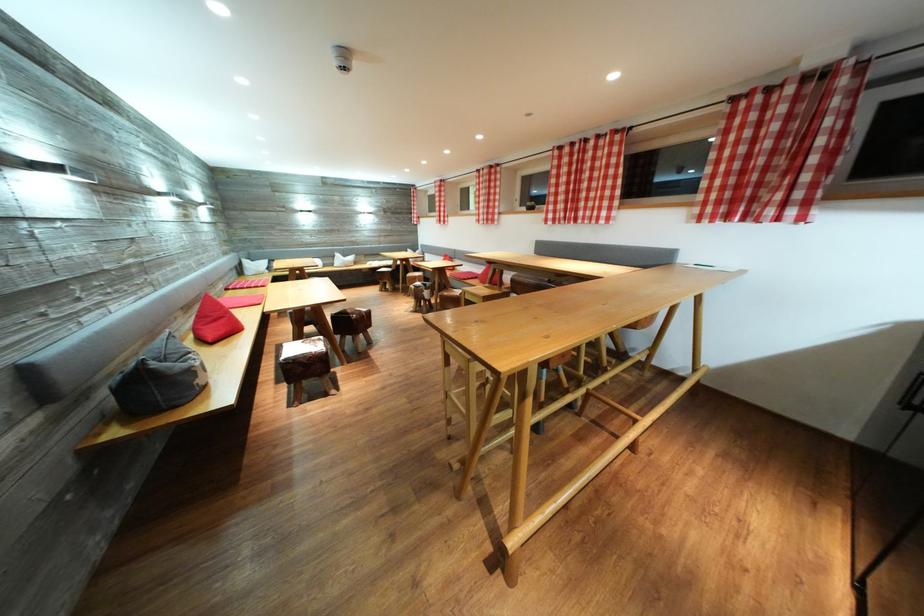
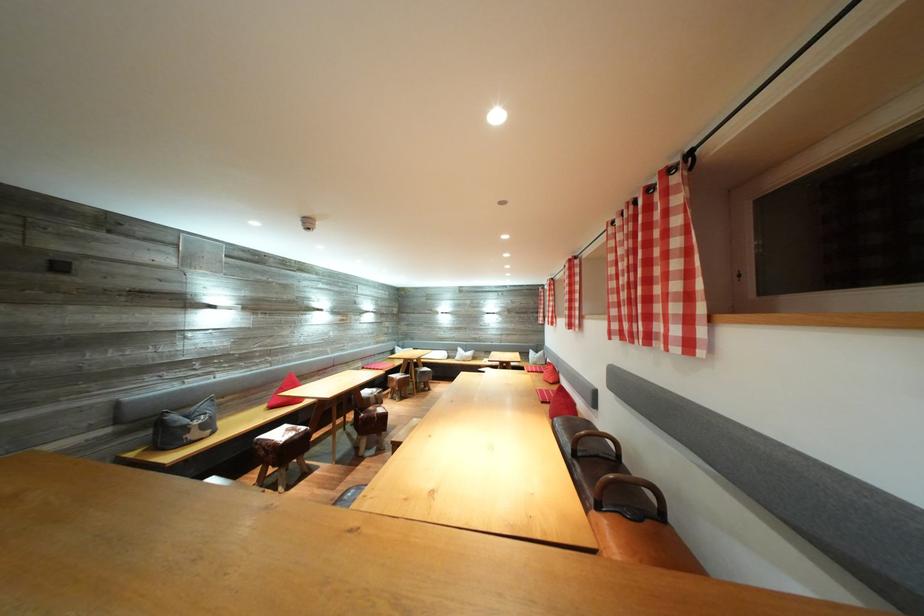
Where in the second image is the point corresponding to (187,371) from the first image?

(192, 427)